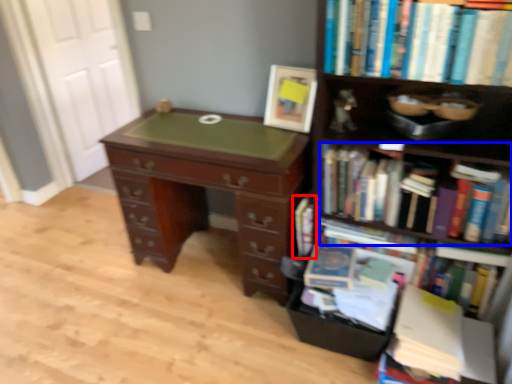
Question: Which object appears closest to the camera in this image, book (highlighted by a red box) or book (highlighted by a blue box)?

Choices:
 (A) book
 (B) book

Answer: (B)